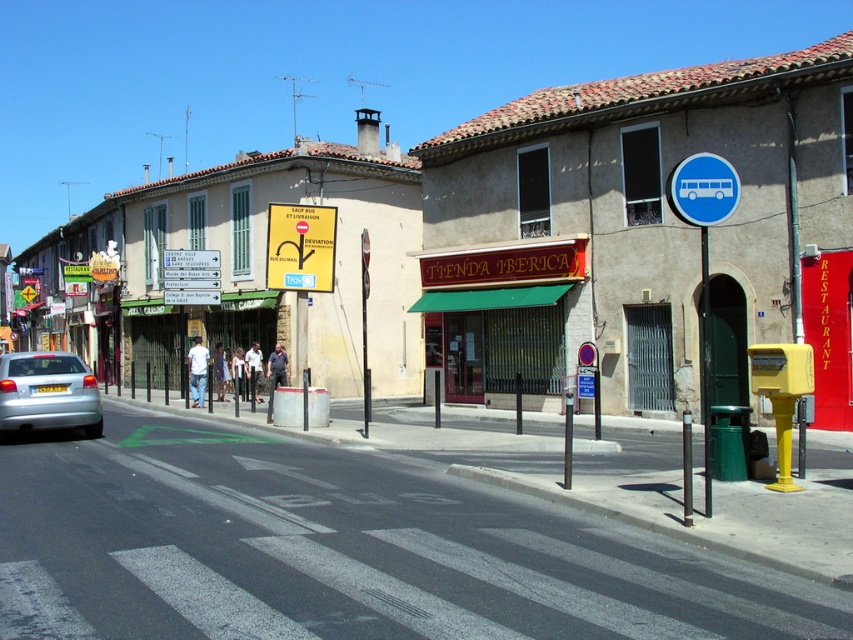
Question: Is blue plastic bus stop sign at center right wider than yellow plastic sign at center?

Choices:
 (A) no
 (B) yes

Answer: (B)

Question: Which point appears farthest from the camera in this image?

Choices:
 (A) (166, 257)
 (B) (705, 454)
 (C) (286, 364)

Answer: (C)

Question: Is yellow paper sign at upper center above light blue denim jeans at center?

Choices:
 (A) yes
 (B) no

Answer: (A)

Question: Does yellow plastic sign at center have a larger size compared to yellow plastic sign at upper center?

Choices:
 (A) yes
 (B) no

Answer: (A)

Question: Which is nearer to the light blue jeans at center?

Choices:
 (A) white cotton shirt at center
 (B) denim pants at center
 (C) yellow paper sign at upper center

Answer: (A)

Question: Which point is closer to the camera?

Choices:
 (A) (198, 340)
 (B) (332, 241)
 (C) (688, 192)

Answer: (C)